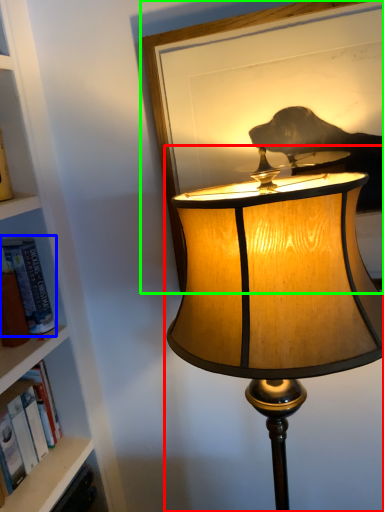
Question: Estimate the real-world distances between objects in this image. Which object is farther from lamp (highlighted by a red box), book (highlighted by a blue box) or picture frame (highlighted by a green box)?

Choices:
 (A) book
 (B) picture frame

Answer: (A)